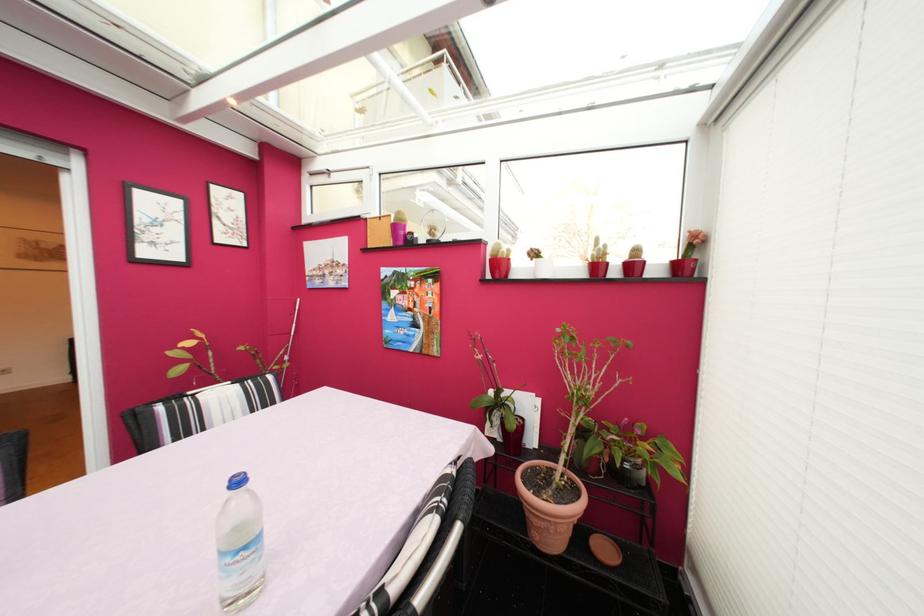
At what (x,y) coordinates should I click in order to perform the action: click on plastic water bottle. Please return your answer as a coordinate pair (x, y). This screenshot has width=924, height=616. Looking at the image, I should click on (238, 545).